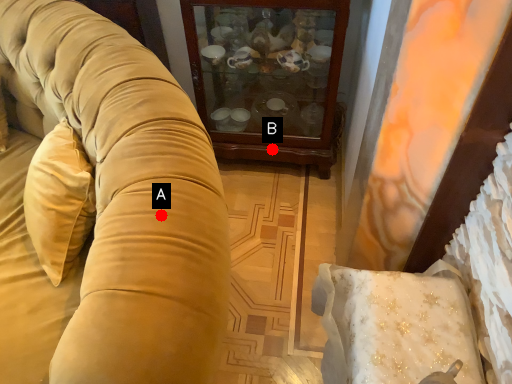
Question: Two points are circled on the image, labeled by A and B beside each circle. Among these points, which one is farthest from the camera?

Choices:
 (A) A is further
 (B) B is further

Answer: (B)